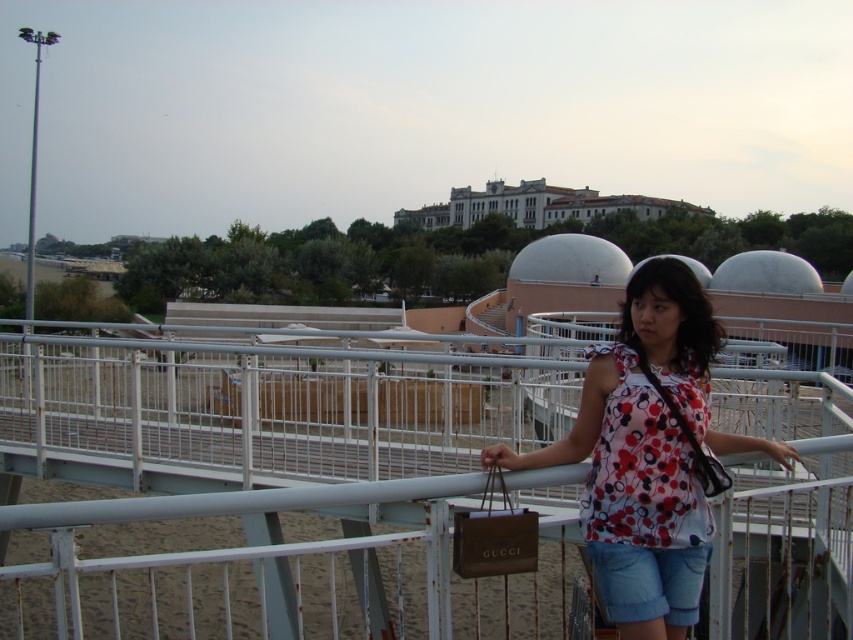
Can you confirm if floral fabric blouse at center is wider than denim shorts at lower center?

Yes, floral fabric blouse at center is wider than denim shorts at lower center.

Can you confirm if floral fabric blouse at center is shorter than denim shorts at lower center?

In fact, floral fabric blouse at center may be taller than denim shorts at lower center.

Where is `floral fabric blouse at center`? This screenshot has width=853, height=640. floral fabric blouse at center is located at coordinates (648, 452).

The width and height of the screenshot is (853, 640). What are the coordinates of `floral fabric blouse at center` in the screenshot? It's located at (648, 452).

Is white metal pedestrian bridge at center below floral fabric blouse at center?

Yes.

Measure the distance between white metal pedestrian bridge at center and floral fabric blouse at center.

A distance of 8.63 meters exists between white metal pedestrian bridge at center and floral fabric blouse at center.

Locate an element on the screen. Image resolution: width=853 pixels, height=640 pixels. white metal pedestrian bridge at center is located at coordinates (281, 484).

Can you confirm if white metal pedestrian bridge at center is taller than brown leather bag at lower center?

Yes, white metal pedestrian bridge at center is taller than brown leather bag at lower center.

Does white metal pedestrian bridge at center appear on the left side of brown leather bag at lower center?

In fact, white metal pedestrian bridge at center is to the right of brown leather bag at lower center.

What are the coordinates of `white metal pedestrian bridge at center` in the screenshot? It's located at (281, 484).